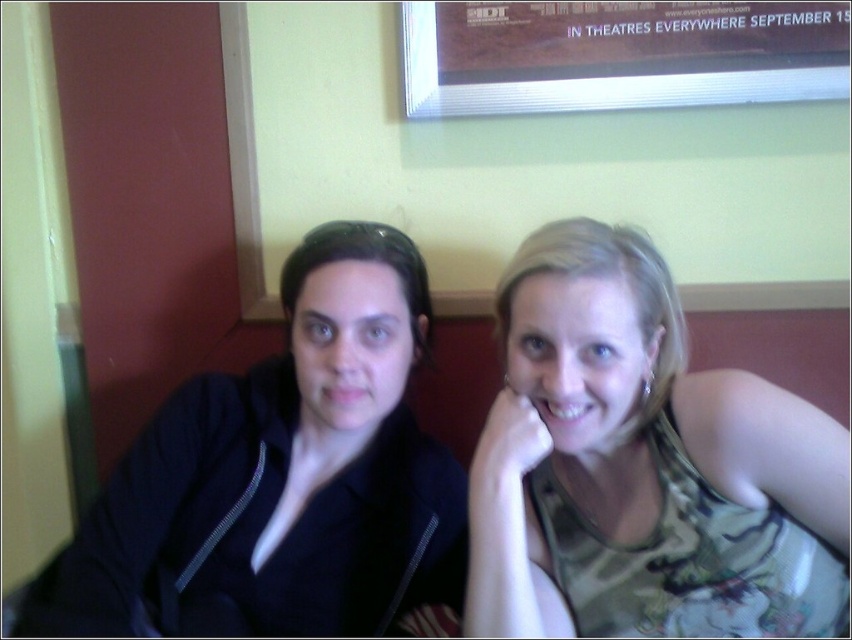
Who is taller, camouflage tank top at center or white glossy teeth at center?

Standing taller between the two is camouflage tank top at center.

What do you see at coordinates (642, 465) in the screenshot? I see `camouflage tank top at center` at bounding box center [642, 465].

In order to click on camouflage tank top at center in this screenshot , I will do `click(642, 465)`.

Is camouflage tank top at center to the right of black matte jacket at left from the viewer's perspective?

Indeed, camouflage tank top at center is positioned on the right side of black matte jacket at left.

Based on the photo, is camouflage tank top at center thinner than black matte jacket at left?

Yes.

Is point (568, 340) positioned after point (199, 611)?

No, it is not.

Identify the location of camouflage tank top at center. This screenshot has height=640, width=852. (642, 465).

Who is positioned more to the left, camouflage tank top at center or matte black mouth at center?

matte black mouth at center

Between point (678, 408) and point (344, 381), which one is positioned behind?

The point (344, 381) is behind.

Where is `camouflage tank top at center`? The width and height of the screenshot is (852, 640). camouflage tank top at center is located at coordinates (642, 465).